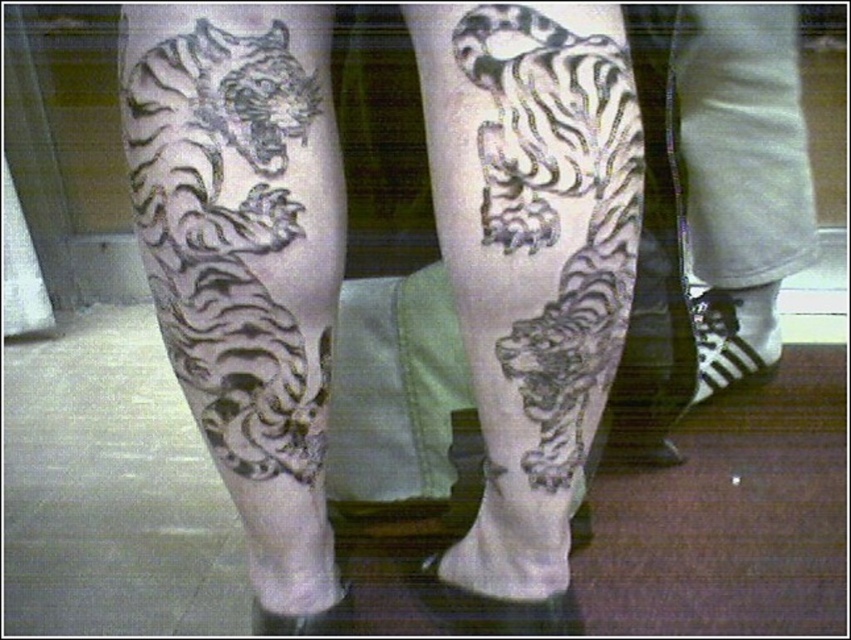
Between black ink tiger at upper left and white cotton socks at lower right, which one has more height?

With more height is black ink tiger at upper left.

Find the location of a particular element. The width and height of the screenshot is (851, 640). black ink tiger at upper left is located at coordinates (244, 260).

Between black ink tiger at upper left and black ink tiger at center, which one is positioned higher?

black ink tiger at center is higher up.

Does point (215, 280) come closer to viewer compared to point (620, 280)?

Yes, it is.

Locate an element on the screen. The image size is (851, 640). black ink tiger at upper left is located at coordinates (244, 260).

Which is below, black ink tiger at center or white cotton socks at lower right?

black ink tiger at center is below.

Is black ink tiger at center bigger than white cotton socks at lower right?

Actually, black ink tiger at center might be smaller than white cotton socks at lower right.

Who is more forward, (529,161) or (794,227)?

Point (529,161)

Find the location of a particular element. black ink tiger at center is located at coordinates (541, 221).